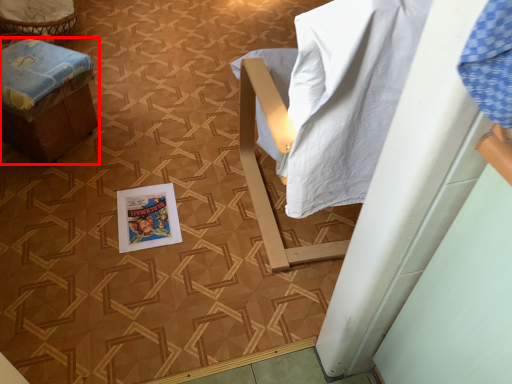
Question: From the image, what is the correct spatial relationship of furniture (annotated by the red box) in relation to comic book?

Choices:
 (A) left
 (B) right

Answer: (A)